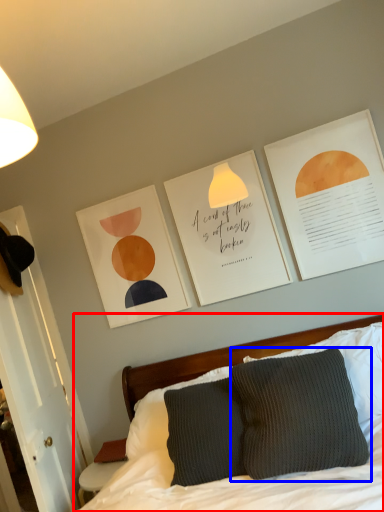
Question: Which point is further to the camera, bed (highlighted by a red box) or pillow (highlighted by a blue box)?

Choices:
 (A) bed
 (B) pillow

Answer: (B)